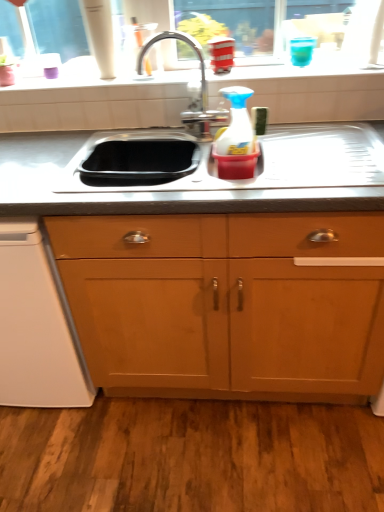
Question: Relative to white plastic dishwasher at lower left, is polished chrome faucet at center in front or behind?

Choices:
 (A) behind
 (B) front

Answer: (A)

Question: Is point (183, 34) closer or farther from the camera than point (87, 389)?

Choices:
 (A) closer
 (B) farther

Answer: (B)

Question: Which of these objects is positioned closest to the polished chrome faucet at center?

Choices:
 (A) wooden cabinet at center
 (B) white plastic dishwasher at lower left
 (C) white glossy window sill at upper center
 (D) stainless steel sink at center
 (E) translucent plastic spray bottle at center

Answer: (E)

Question: Which of these objects is positioned closest to the white plastic dishwasher at lower left?

Choices:
 (A) translucent plastic spray bottle at center
 (B) stainless steel sink at center
 (C) white glossy window sill at upper center
 (D) wooden cabinet at center
 (E) polished chrome faucet at center

Answer: (D)